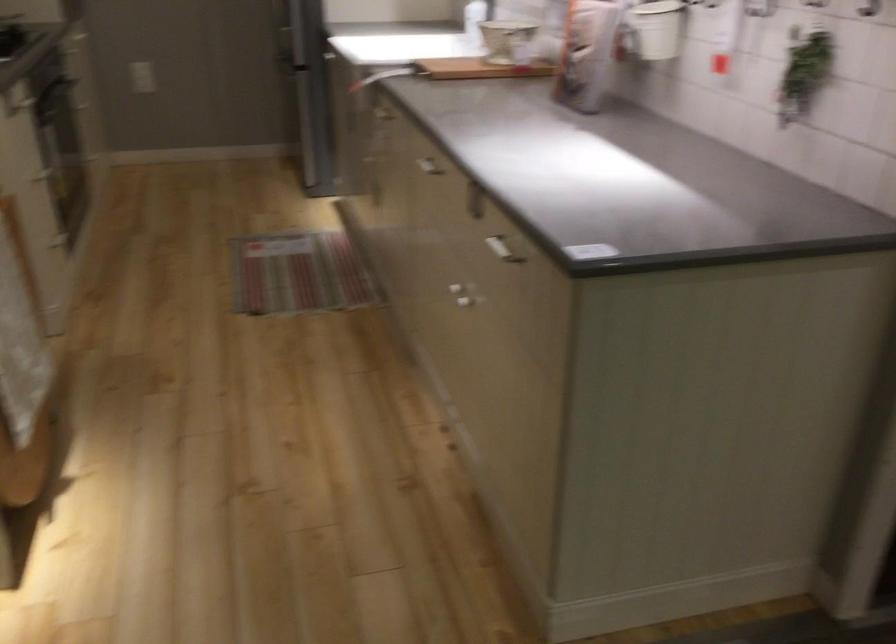
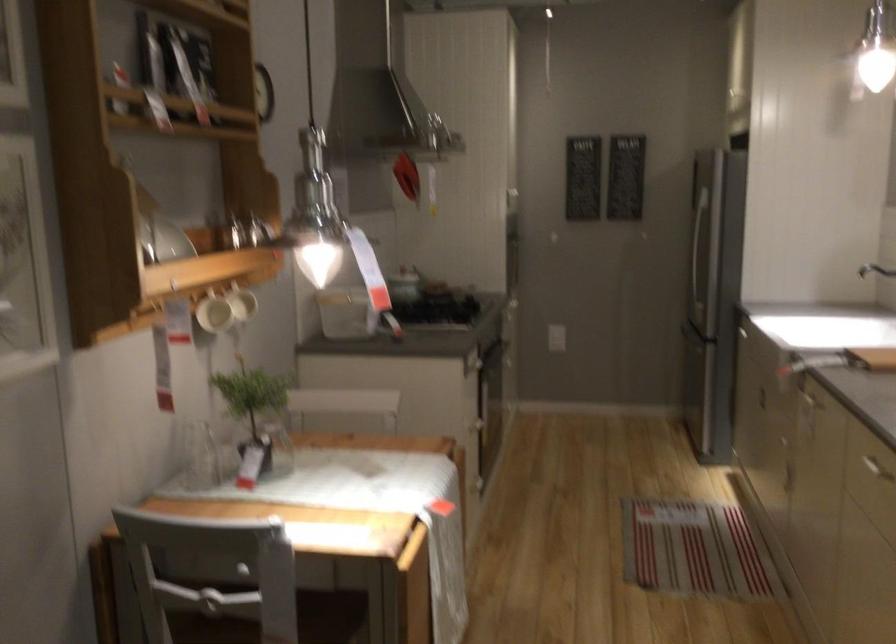
Find the pixel in the second image that matches the point at 416,169 in the first image.

(872, 467)